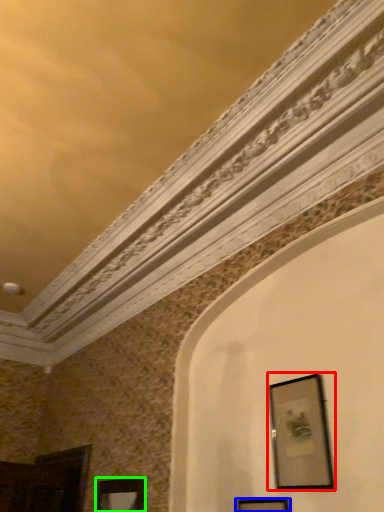
Question: Estimate the real-world distances between objects in this image. Which object is closer to picture frame (highlighted by a red box), picture frame (highlighted by a blue box) or picture frame (highlighted by a green box)?

Choices:
 (A) picture frame
 (B) picture frame

Answer: (A)